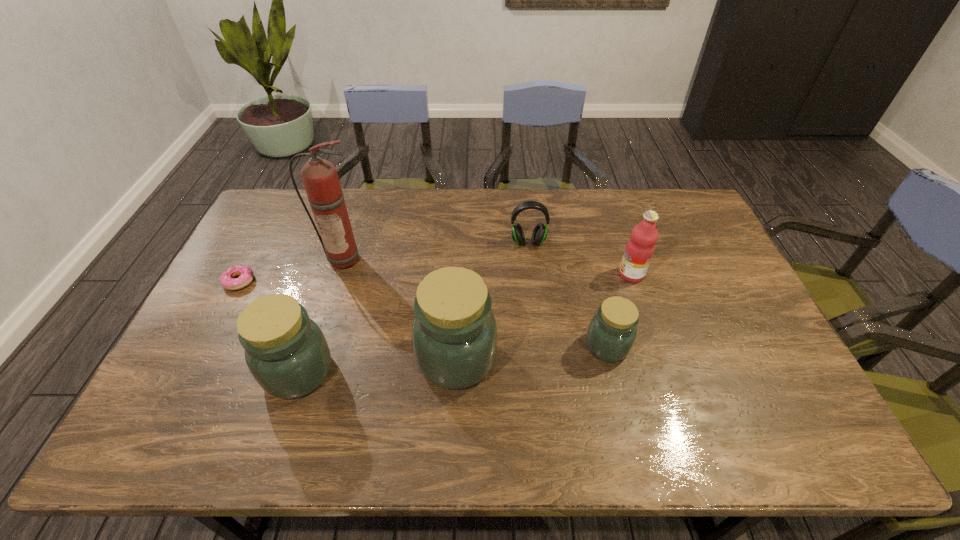
Locate an element on the screen. The image size is (960, 540). vacant place for an extra jar on the right is located at coordinates (752, 334).